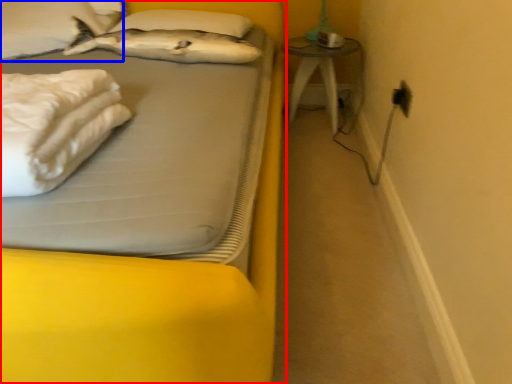
Question: Which of the following is the farthest to the observer, bed (highlighted by a red box) or pillow (highlighted by a blue box)?

Choices:
 (A) bed
 (B) pillow

Answer: (B)